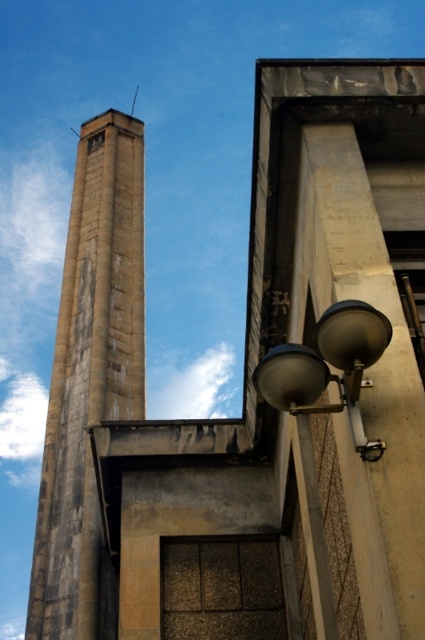
You are standing in front of the building and want to take a photo. You notice two points marked on the building. The first point is at coordinates point (141,403) and the second point is at point (328,381). Which point is closer to your camera?

Point (141,403) is further to the camera than point (328,381), so the closer point to your camera is point (328,381).

You are an architect inspecting the building. You need to compare the sizes of the concrete tower at left and the satin silver lamp at lower right. Which one is wider?

The concrete tower at left is wider than the satin silver lamp at lower right.

You are an architect inspecting the building. You notice the concrete tower at left and the satin silver lamp at lower right. Which object occupies more space in the scene?

The concrete tower at left is larger in size than the satin silver lamp at lower right, so it occupies more space in the scene.